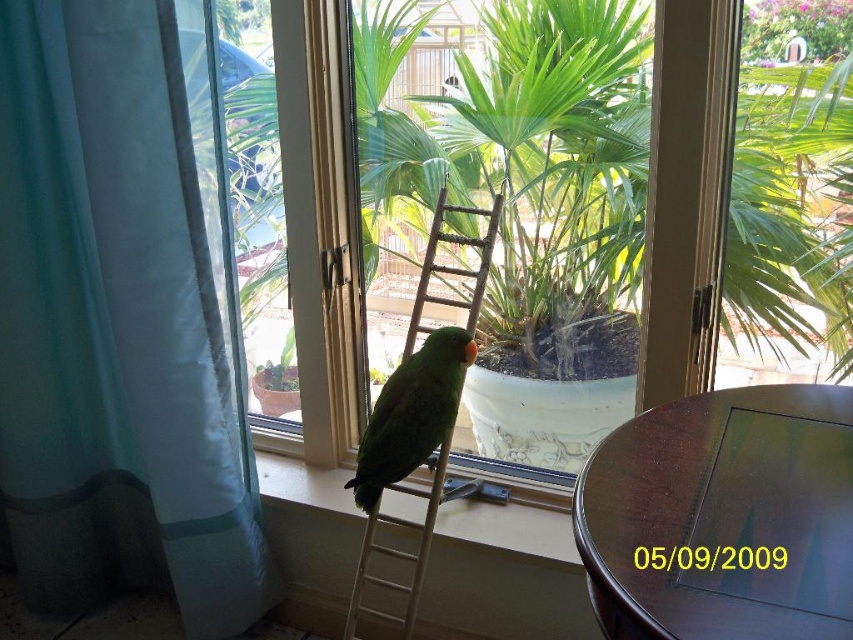
You are standing in the room looking at the window. There are two points marked in the scene, one at point coordinates point (120, 332) and another at point coordinates point (614, 67). Which point is closer to you?

Point (120, 332) is closer to you because it is further to the viewer than point (614, 67).

You are an interior designer assessing the space. The teal fabric curtain at left and the green leafy plant at center are both in the room. Which object takes up more horizontal space?

The green leafy plant at center has a greater width than the teal fabric curtain at left, so it takes up more horizontal space.

You are a window cleaner needing to place a ladder exactly at the white smooth window sill at center. Given that the window sill is at coordinates point 0.827, 0.599, can you determine the exact location to place the ladder?

The white smooth window sill at center is located at coordinates point (509, 529), so the ladder should be placed precisely at that coordinate point to reach it.